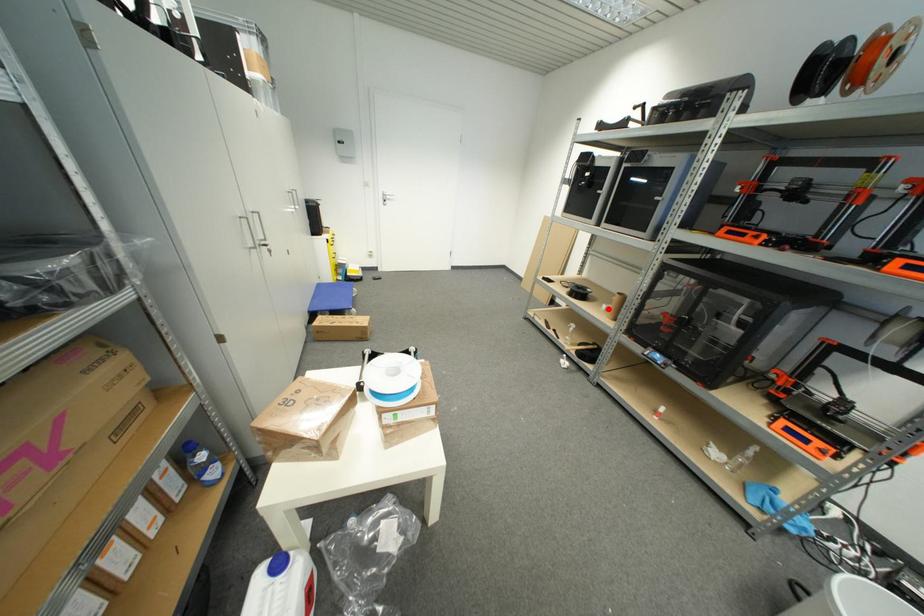
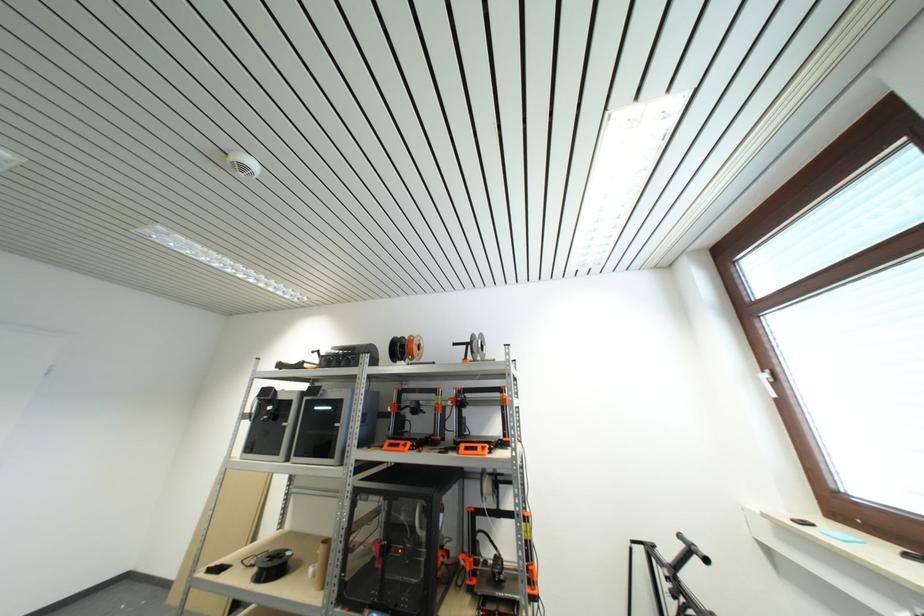
Locate, in the second image, the point that corresponds to the highlighted location in the first image.

(314, 573)